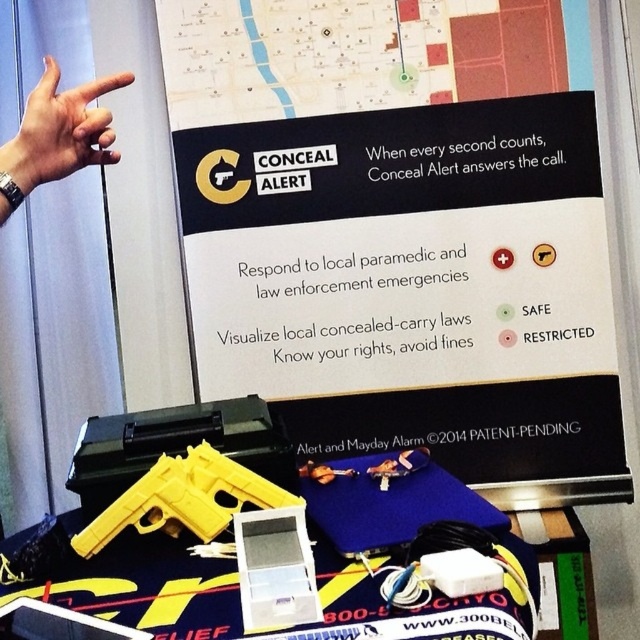
Question: Which of the following is the farthest from the observer?

Choices:
 (A) (177, 516)
 (B) (20, 141)

Answer: (A)

Question: Is yellow plastic handgun at lower center further to the viewer compared to skinny silver watch at upper left?

Choices:
 (A) yes
 (B) no

Answer: (A)

Question: Which object is the farthest from the yellow plastic gun at lower left?

Choices:
 (A) yellow plastic handgun at lower center
 (B) skinny silver watch at upper left

Answer: (B)

Question: Which point appears farthest from the camera in this image?

Choices:
 (A) (278, 211)
 (B) (92, 140)

Answer: (A)

Question: Is yellow plastic handgun at lower center wider than skinny silver watch at upper left?

Choices:
 (A) no
 (B) yes

Answer: (B)

Question: Can you confirm if yellow plastic gun at lower left is positioned to the left of skinny silver watch at upper left?

Choices:
 (A) yes
 (B) no

Answer: (B)